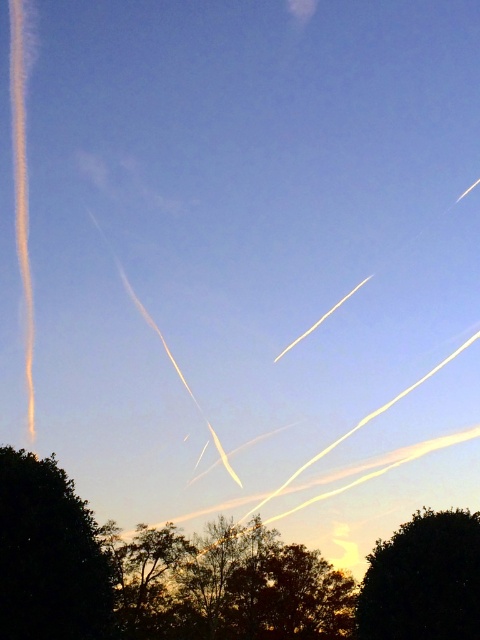
From the picture: You are an observer standing in front of the scene. There are two trees in the image, the green leafy tree at lower center and the dark green leafy tree at lower left. Which tree is located to the right of the other?

The green leafy tree at lower center is positioned on the right side of dark green leafy tree at lower left.

You are an astronomer observing the sky and want to determine the order of two points in the scene. Which point is closer to the observer, point (261, 528) or point (38, 612)?

Point (38, 612) is closer to the observer because point (261, 528) is behind it.

You are an ornithologist observing birds in the sky. You notice two trees below you, the green leafy tree at lower center and the brown textured tree at center. Which tree would you expect to provide a higher nesting spot for birds?

The green leafy tree at lower center is taller than the brown textured tree at center, so it would provide a higher nesting spot for birds.